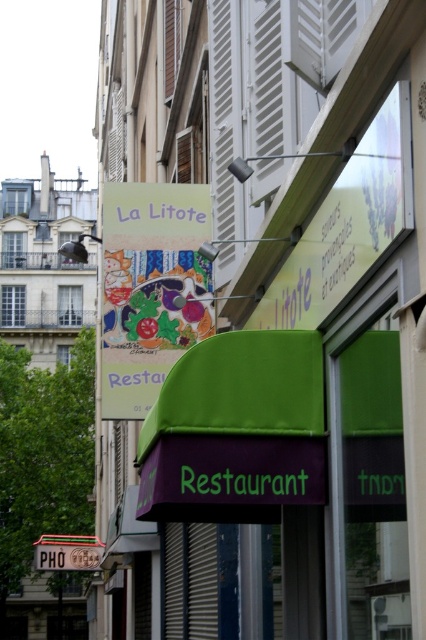
Question: Which object is farther from the camera taking this photo?

Choices:
 (A) metallic silver shutter at center
 (B) matte colorful signboard at center

Answer: (B)

Question: Can you confirm if matte colorful signboard at center is positioned to the left of metallic silver shutter at center?

Choices:
 (A) yes
 (B) no

Answer: (A)

Question: Is matte colorful signboard at center above metallic silver shutter at center?

Choices:
 (A) yes
 (B) no

Answer: (A)

Question: Can you confirm if matte colorful signboard at center is positioned below metallic silver shutter at center?

Choices:
 (A) yes
 (B) no

Answer: (B)

Question: Which of the following is the farthest from the observer?

Choices:
 (A) (161, 269)
 (B) (164, 570)

Answer: (B)